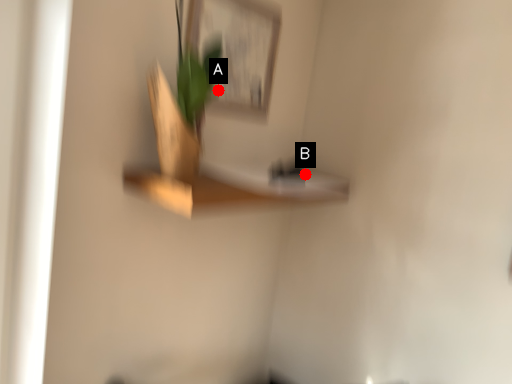
Question: Two points are circled on the image, labeled by A and B beside each circle. Which of the following is the closest to the observer?

Choices:
 (A) A is closer
 (B) B is closer

Answer: (A)